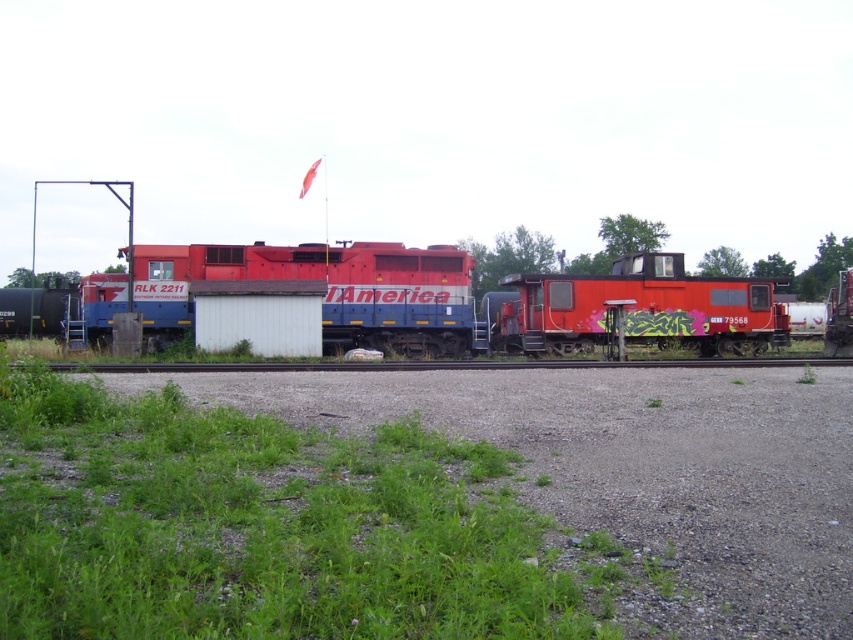
Question: Observing the image, what is the correct spatial positioning of matte red train at center in reference to shiny red train car at center?

Choices:
 (A) left
 (B) right

Answer: (A)

Question: Which point is closer to the camera?

Choices:
 (A) matte red train at center
 (B) black asphalt train track at center

Answer: (B)

Question: Is matte red train at center positioned at the back of black asphalt train track at center?

Choices:
 (A) no
 (B) yes

Answer: (B)

Question: Which of the following is the closest to the observer?

Choices:
 (A) (659, 259)
 (B) (427, 348)

Answer: (B)

Question: Which object is positioned closest to the matte red train at center?

Choices:
 (A) shiny red train car at center
 (B) black asphalt train track at center

Answer: (A)

Question: Is matte red train at center bigger than shiny red train car at center?

Choices:
 (A) yes
 (B) no

Answer: (A)